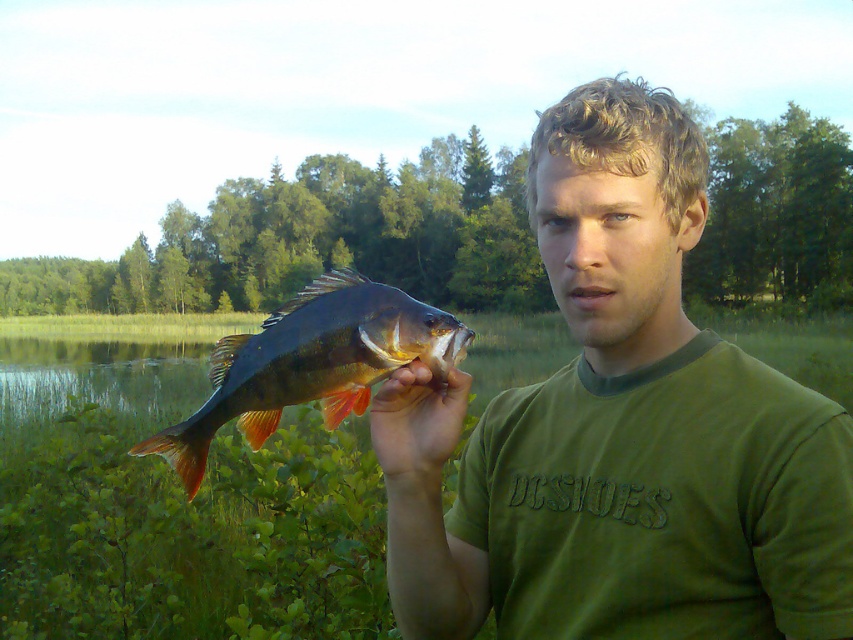
From the picture: You are a photographer trying to capture the reflection of the green cotton shirt at center and the smooth skin hand at center in a nearby pond. Which object will have its reflection appear larger in the water?

The green cotton shirt at center is closer to the viewer than the smooth skin hand at center, so its reflection will appear larger in the water.

You are a tailor measuring the distance between the green cotton shirt at center and the smooth skin hand at center for a custom fitting. Can you fit a 20 cm long ruler between them?

The distance between the green cotton shirt at center and the smooth skin hand at center is 22.41 centimeters, so yes, a 20 cm ruler can fit between them as there is enough space.